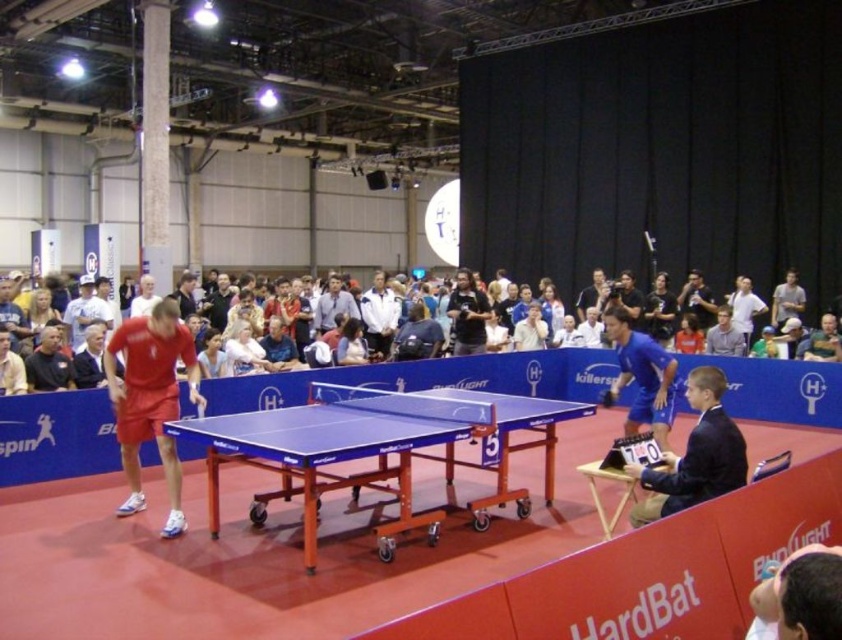
From the picture: Can you confirm if matte red shorts at left is smaller than dark blue shirt at center?

Incorrect, matte red shorts at left is not smaller in size than dark blue shirt at center.

Describe the element at coordinates (150, 397) in the screenshot. I see `matte red shorts at left` at that location.

Find the location of `matte red shorts at left`. matte red shorts at left is located at coordinates (150, 397).

Find the location of a particular element. The width and height of the screenshot is (842, 640). matte red shorts at left is located at coordinates (150, 397).

In order to click on blue plastic table at center in this screenshot , I will do `click(379, 451)`.

Looking at this image, can you confirm if blue plastic table at center is thinner than light gray fabric shirt at center?

No, blue plastic table at center is not thinner than light gray fabric shirt at center.

Between point (209, 512) and point (712, 340), which one is positioned in front?

Point (209, 512) is more forward.

The width and height of the screenshot is (842, 640). What are the coordinates of `blue plastic table at center` in the screenshot? It's located at (379, 451).

Is matte red shorts at left bigger than dark blue suit at right?

Correct, matte red shorts at left is larger in size than dark blue suit at right.

Is matte red shorts at left positioned at the back of dark blue suit at right?

Yes, it is.

Is point (140, 440) farther from viewer compared to point (722, 461)?

Yes.

What are the coordinates of `matte red shorts at left` in the screenshot? It's located at (150, 397).